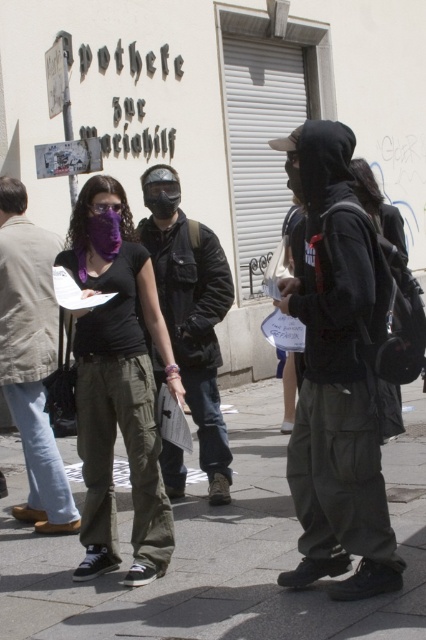
Between point (170, 474) and point (120, 208), which one is positioned in front?

Point (120, 208) is more forward.

Measure the distance between matte black helmet at center and purple matte goggles at center.

A distance of 4.42 feet exists between matte black helmet at center and purple matte goggles at center.

Describe the element at coordinates (190, 310) in the screenshot. The height and width of the screenshot is (640, 426). I see `matte black helmet at center` at that location.

In order to click on matte black helmet at center in this screenshot , I will do click(x=190, y=310).

Between denim pants at center and purple matte goggles at center, which one has less height?

purple matte goggles at center

Can you confirm if denim pants at center is positioned above purple matte goggles at center?

Actually, denim pants at center is below purple matte goggles at center.

Does point (28, 280) come behind point (106, 209)?

Yes.

In order to click on denim pants at center in this screenshot , I will do `click(31, 356)`.

Measure the distance between dark green cargo pants at center and camera.

dark green cargo pants at center is 3.02 meters away from camera.

Is point (371, 497) positioned in front of point (100, 205)?

Yes, point (371, 497) is closer to viewer.

Is point (394, 412) closer to viewer compared to point (120, 212)?

That is True.

Where is `dark green cargo pants at center`? The height and width of the screenshot is (640, 426). dark green cargo pants at center is located at coordinates (336, 380).